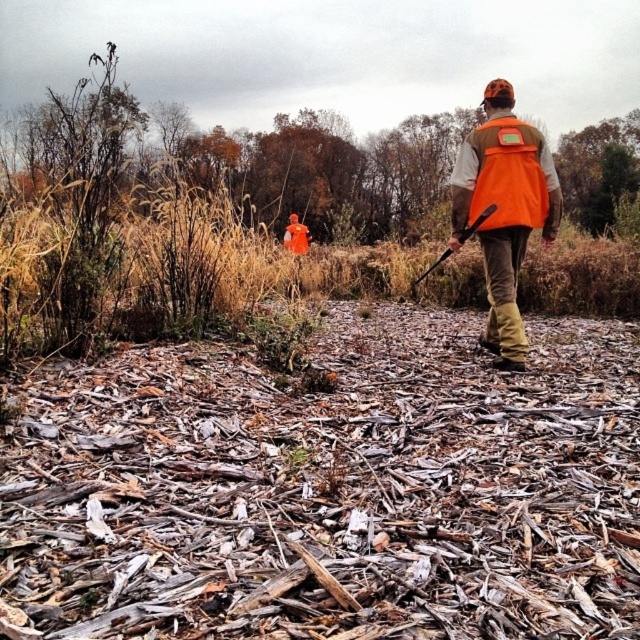
In the scene shown: Is orange fabric vest at center smaller than orange matte safety vest at center?

Actually, orange fabric vest at center might be larger than orange matte safety vest at center.

Is orange fabric vest at center to the right of orange matte safety vest at center from the viewer's perspective?

Yes, orange fabric vest at center is to the right of orange matte safety vest at center.

Measure the distance between orange fabric vest at center and camera.

orange fabric vest at center and camera are 4.29 meters apart.

Locate an element on the screen. orange fabric vest at center is located at coordinates (504, 211).